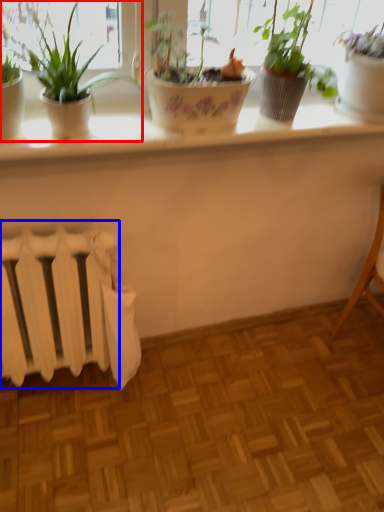
Question: Among these objects, which one is nearest to the camera, houseplant (highlighted by a red box) or radiator (highlighted by a blue box)?

Choices:
 (A) houseplant
 (B) radiator

Answer: (A)